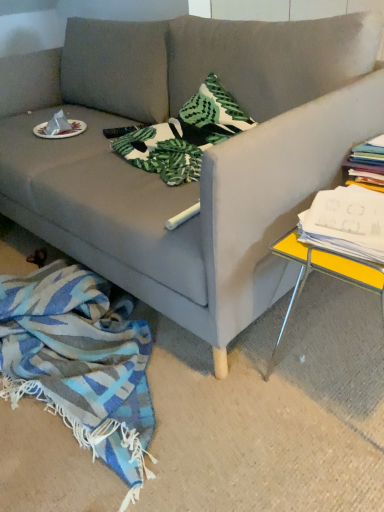
Describe the element at coordinates (324, 272) in the screenshot. I see `yellow metallic table at right` at that location.

In order to face blue woven blanket at lower left, should I rotate leftwards or rightwards?

To face it directly, rotate left by 15.289 degrees.

Describe the element at coordinates (204, 154) in the screenshot. I see `matte gray couch at center` at that location.

Image resolution: width=384 pixels, height=512 pixels. I want to click on yellow metallic table at right, so click(324, 272).

Is blue woven blanket at lower left situated inside white paper plate at upper left or outside?

blue woven blanket at lower left is located beyond the bounds of white paper plate at upper left.

How many degrees apart are the facing directions of blue woven blanket at lower left and white paper plate at upper left?

The facing directions of blue woven blanket at lower left and white paper plate at upper left are 90 degrees apart.

Consider the image. Does blue woven blanket at lower left have a larger size compared to white paper plate at upper left?

Correct, blue woven blanket at lower left is larger in size than white paper plate at upper left.

Is blue woven blanket at lower left closer to camera compared to white paper plate at upper left?

Yes, blue woven blanket at lower left is closer to the camera.

What's the angular difference between yellow metallic table at right and matte gray couch at center's facing directions?

The angle between the facing direction of yellow metallic table at right and the facing direction of matte gray couch at center is 91.9 degrees.

Is yellow metallic table at right oriented away from matte gray couch at center?

That's not correct — yellow metallic table at right is not looking away from matte gray couch at center.

Considering the points (379, 280) and (180, 244), which point is in front, point (379, 280) or point (180, 244)?

The point (379, 280) is closer to the camera.

From a real-world perspective, is yellow metallic table at right positioned over matte gray couch at center based on gravity?

Indeed, from a real-world perspective, yellow metallic table at right stands above matte gray couch at center.

Considering the positions of objects white paper stack at right and matte gray couch at center in the image provided, who is behind, white paper stack at right or matte gray couch at center?

Positioned behind is white paper stack at right.

Can you confirm if white paper stack at right is positioned to the left of matte gray couch at center?

Yes.

Based on the photo, is white paper stack at right oriented towards matte gray couch at center?

No, white paper stack at right is not facing towards matte gray couch at center.

Is point (80, 277) farther from viewer compared to point (346, 238)?

Yes, point (80, 277) is farther from viewer.

Find the location of a particular element. This screenshot has height=512, width=384. magazine above the blue woven blanket at lower left (from a real-world perspective) is located at coordinates (346, 222).

Is blue woven blanket at lower left facing towards white paper stack at right?

No, blue woven blanket at lower left is not aimed at white paper stack at right.

Is blue woven blanket at lower left surrounding white paper stack at right?

No, white paper stack at right is located outside of blue woven blanket at lower left.

Is white paper stack at right wider than white paper plate at upper left?

Yes.

From the image's perspective, between white paper stack at right and white paper plate at upper left, which one is located above?

white paper plate at upper left, from the image's perspective.

Who is smaller, white paper stack at right or white paper plate at upper left?

white paper plate at upper left is smaller.

Can you tell me how much blue woven blanket at lower left and yellow metallic table at right differ in facing direction?

The angle between the facing direction of blue woven blanket at lower left and the facing direction of yellow metallic table at right is 0.0501 degrees.

Does blue woven blanket at lower left have a greater height compared to yellow metallic table at right?

Incorrect, the height of blue woven blanket at lower left is not larger of that of yellow metallic table at right.

Is point (37, 291) closer or farther from the camera than point (277, 244)?

Clearly, point (37, 291) is more distant from the camera than point (277, 244).

Is yellow metallic table at right at the back of blue woven blanket at lower left?

blue woven blanket at lower left does not have its back to yellow metallic table at right.

Does matte gray couch at center have a greater height compared to yellow metallic table at right?

No.

Would you say matte gray couch at center is to the left or to the right of yellow metallic table at right in the picture?

From the image, it's evident that matte gray couch at center is to the right of yellow metallic table at right.

Considering the relative positions of matte gray couch at center and yellow metallic table at right in the image provided, is matte gray couch at center behind yellow metallic table at right?

No, matte gray couch at center is closer to the viewer.

From a real-world perspective, which is physically below, matte gray couch at center or yellow metallic table at right?

matte gray couch at center, from a real-world perspective.

Identify the location of blanket that appears below the white paper plate at upper left (from the image's perspective). (81, 362).

What are the coordinates of `table above the matte gray couch at center (from a real-world perspective)` in the screenshot? It's located at (324, 272).

Based on their spatial positions, is white paper plate at upper left or blue woven blanket at lower left closer to yellow metallic table at right?

blue woven blanket at lower left is closer to yellow metallic table at right.

Looking at the image, which one is located closer to yellow metallic table at right, matte gray couch at center or white paper plate at upper left?

matte gray couch at center lies closer to yellow metallic table at right than the other object.

Looking at the image, which one is located further to blue woven blanket at lower left, matte gray couch at center or white paper stack at right?

white paper stack at right lies further to blue woven blanket at lower left than the other object.

Estimate the real-world distances between objects in this image. Which object is further from white paper stack at right, white paper plate at upper left or matte gray couch at center?

white paper plate at upper left lies further to white paper stack at right than the other object.

Considering their positions, is matte gray couch at center positioned further to blue woven blanket at lower left than yellow metallic table at right?

Based on the image, yellow metallic table at right appears to be further to blue woven blanket at lower left.

Considering their positions, is white paper stack at right positioned further to yellow metallic table at right than matte gray couch at center?

Based on the image, matte gray couch at center appears to be further to yellow metallic table at right.

Which object lies nearer to the anchor point blue woven blanket at lower left, yellow metallic table at right or white paper plate at upper left?

yellow metallic table at right lies closer to blue woven blanket at lower left than the other object.

When comparing their distances from white paper stack at right, does blue woven blanket at lower left or matte gray couch at center seem further?

Based on the image, blue woven blanket at lower left appears to be further to white paper stack at right.

Identify the location of magazine between white paper plate at upper left and matte gray couch at center from left to right. The height and width of the screenshot is (512, 384). (346, 222).

You are a GUI agent. You are given a task and a screenshot of the screen. Output one action in this format:
    pyautogui.click(x=<x>, y=<y>)
    Task: Click on the blanket between white paper plate at upper left and white paper stack at right
    The width and height of the screenshot is (384, 512).
    Given the screenshot: What is the action you would take?
    pyautogui.click(x=81, y=362)

Where is `table between blue woven blanket at lower left and matte gray couch at center in the horizontal direction`? This screenshot has height=512, width=384. table between blue woven blanket at lower left and matte gray couch at center in the horizontal direction is located at coordinates (324, 272).

You are a GUI agent. You are given a task and a screenshot of the screen. Output one action in this format:
    pyautogui.click(x=<x>, y=<y>)
    Task: Click on the magazine situated between white paper plate at upper left and yellow metallic table at right from left to right
    
    Given the screenshot: What is the action you would take?
    pyautogui.click(x=346, y=222)